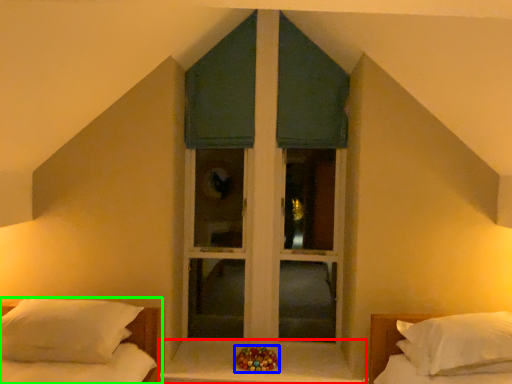
Question: Based on their relative distances, which object is nearer to window sill (highlighted by a red box)? Choose from miniature (highlighted by a blue box) and bed (highlighted by a green box).

Choices:
 (A) miniature
 (B) bed

Answer: (A)